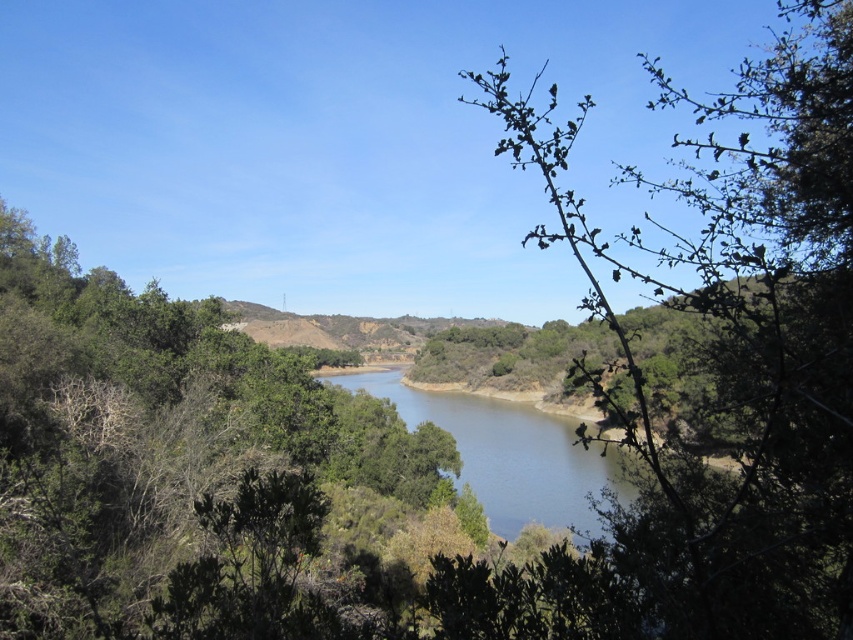
Question: Does green leafy branch at center have a larger size compared to blue smooth water at center?

Choices:
 (A) no
 (B) yes

Answer: (B)

Question: Does green leafy branch at center have a greater width compared to blue smooth water at center?

Choices:
 (A) yes
 (B) no

Answer: (A)

Question: Where is green leafy branch at center located in relation to blue smooth water at center in the image?

Choices:
 (A) right
 (B) left

Answer: (A)

Question: Which object is farther from the camera taking this photo?

Choices:
 (A) blue smooth water at center
 (B) green leafy branch at center

Answer: (A)